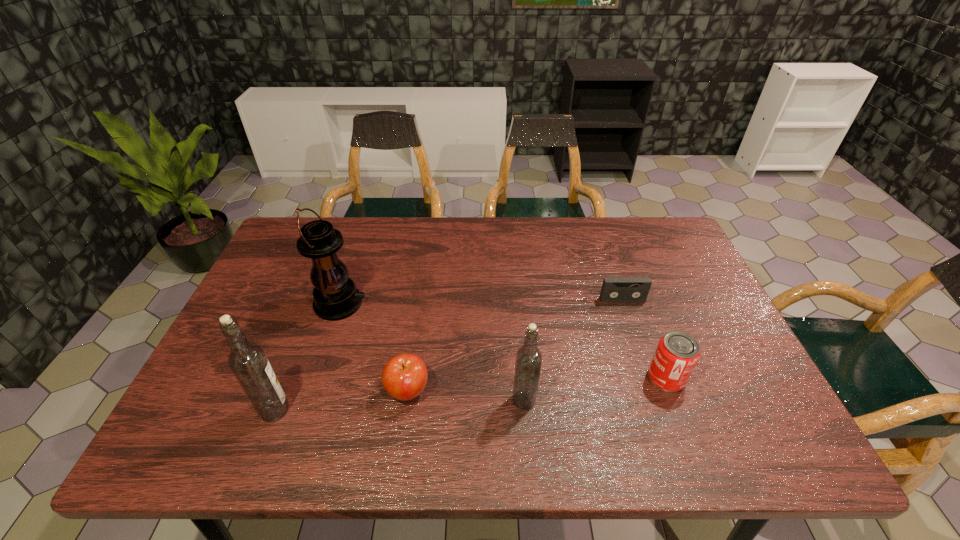
All vodkas are currently evenly spaced. To continue this pattern, where would you add another vodka on the right? Please point out a vacant spot. Please provide its 2D coordinates. Your answer should be formatted as a tuple, i.e. [(x, y)], where the tuple contains the x and y coordinates of a point satisfying the conditions above.

[(764, 390)]